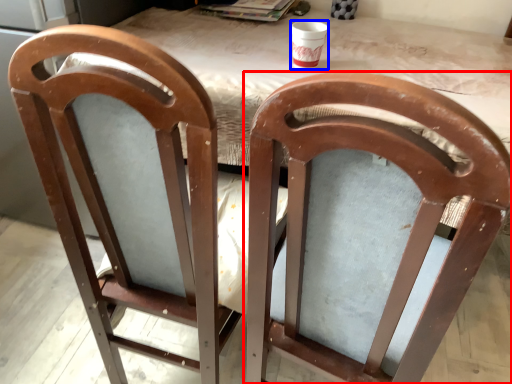
Question: Which point is closer to the camera, chair (highlighted by a red box) or cup (highlighted by a blue box)?

Choices:
 (A) chair
 (B) cup

Answer: (A)